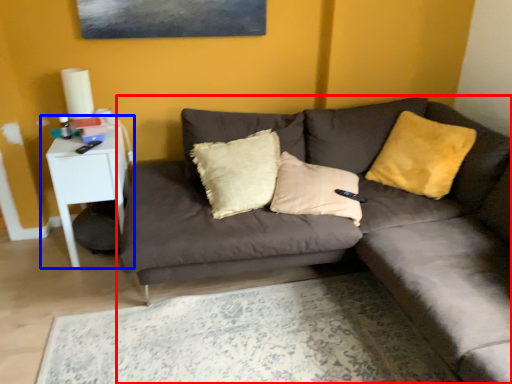
Question: Which object appears closest to the camera in this image, studio couch (highlighted by a red box) or table (highlighted by a blue box)?

Choices:
 (A) studio couch
 (B) table

Answer: (A)